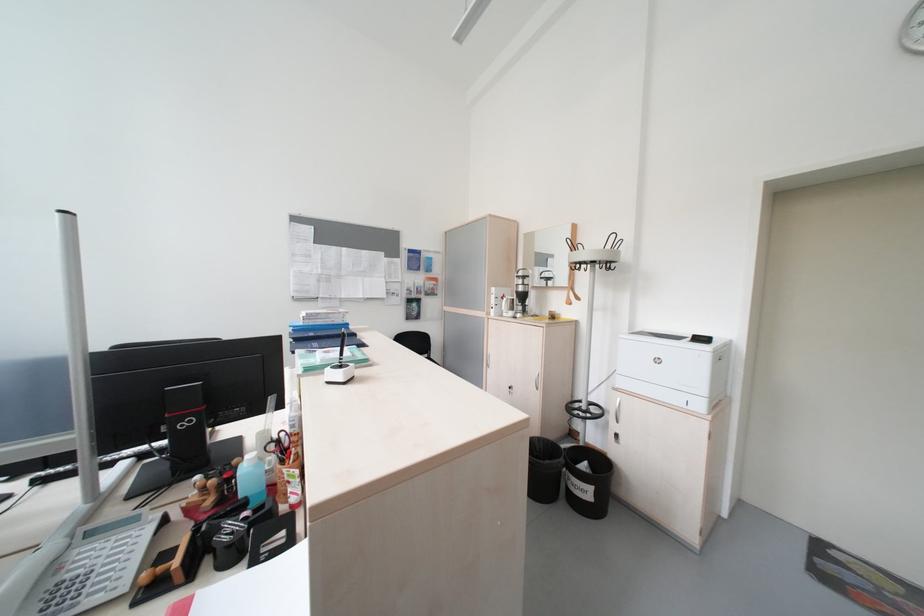
Where would you push the bottle pump dispenser? Please return your answer as a coordinate pair (x, y).

(521, 291)